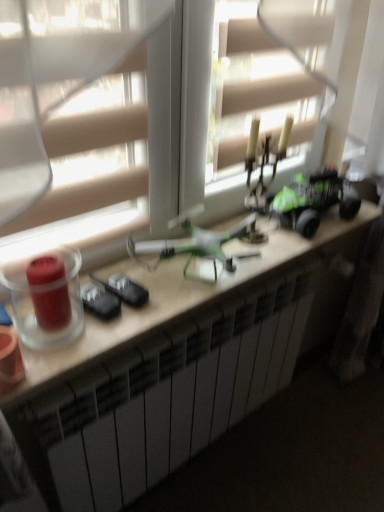
I want to click on vacant space to the right of matte red candle holder at left, the first candle holder from the right, so click(x=125, y=321).